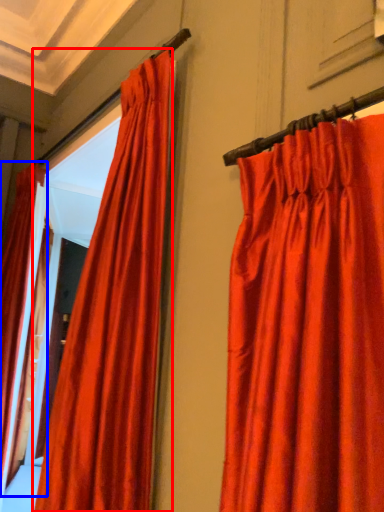
Question: Which of the following is the farthest to the observer, curtain (highlighted by a red box) or curtain (highlighted by a blue box)?

Choices:
 (A) curtain
 (B) curtain

Answer: (B)